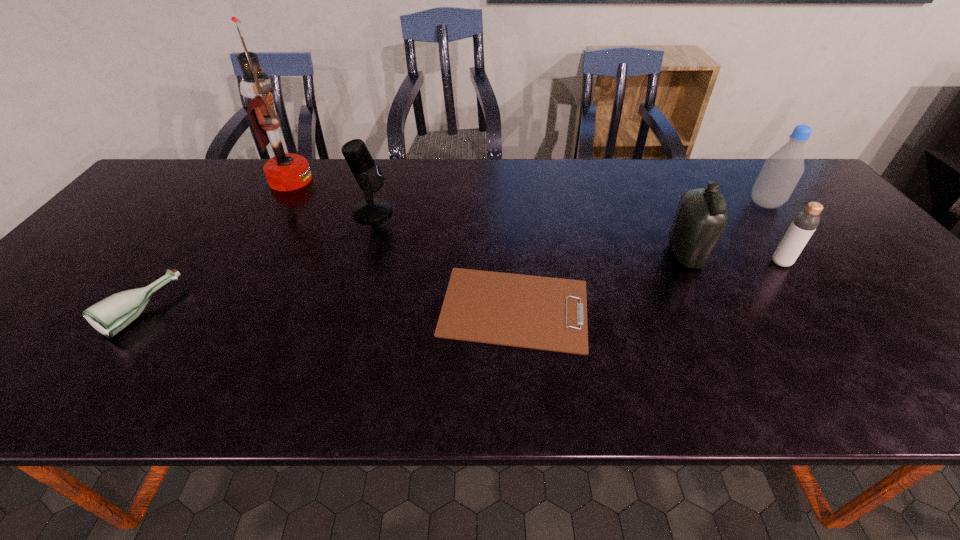
Image resolution: width=960 pixels, height=540 pixels. In order to click on the tallest object in this screenshot , I will do `click(285, 171)`.

At what (x,y) coordinates should I click in order to perform the action: click on nutcracker. Please return your answer as a coordinate pair (x, y). The image size is (960, 540). Looking at the image, I should click on (285, 171).

At what (x,y) coordinates should I click in order to perform the action: click on the rightmost bottle. Please return your answer as a coordinate pair (x, y). Image resolution: width=960 pixels, height=540 pixels. Looking at the image, I should click on (781, 172).

Where is `the farthest bottle`? The width and height of the screenshot is (960, 540). the farthest bottle is located at coordinates (781, 172).

At what (x,y) coordinates should I click in order to perform the action: click on the fifth object from right to left. Please return your answer as a coordinate pair (x, y). This screenshot has height=540, width=960. Looking at the image, I should click on (368, 175).

Locate an element on the screen. The height and width of the screenshot is (540, 960). the second bottle from left to right is located at coordinates (700, 219).

What are the coordinates of `the third tallest bottle` in the screenshot? It's located at (804, 224).

Where is `the third shortest object`? Image resolution: width=960 pixels, height=540 pixels. the third shortest object is located at coordinates (804, 224).

The width and height of the screenshot is (960, 540). I want to click on the leftmost bottle, so click(x=109, y=316).

This screenshot has width=960, height=540. What are the coordinates of `the second shortest object` in the screenshot? It's located at (109, 316).